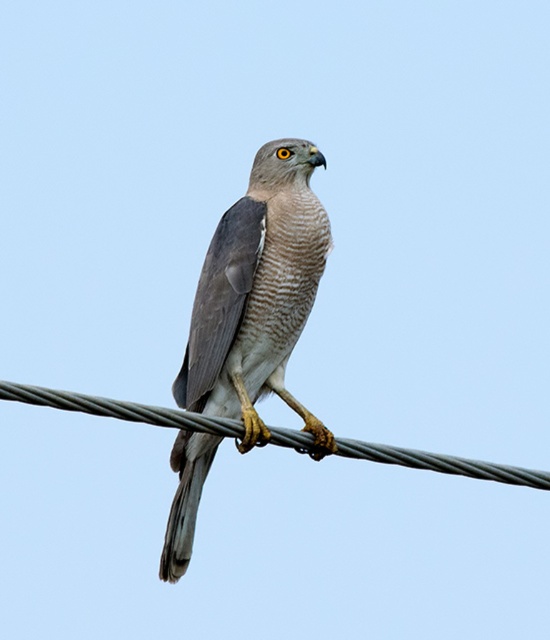
You are an ornithologist analyzing the image. You need to determine the exact position of the gray feathered falcon at center. What are its coordinates?

The gray feathered falcon at center is located at coordinates (257, 294).

In the scene shown: You are a birdwatcher observing the scene. You notice a gray feathered falcon at center and a black wire at center. Which object is positioned higher in the image?

The gray feathered falcon at center is located above the black wire at center, so it is positioned higher in the image.